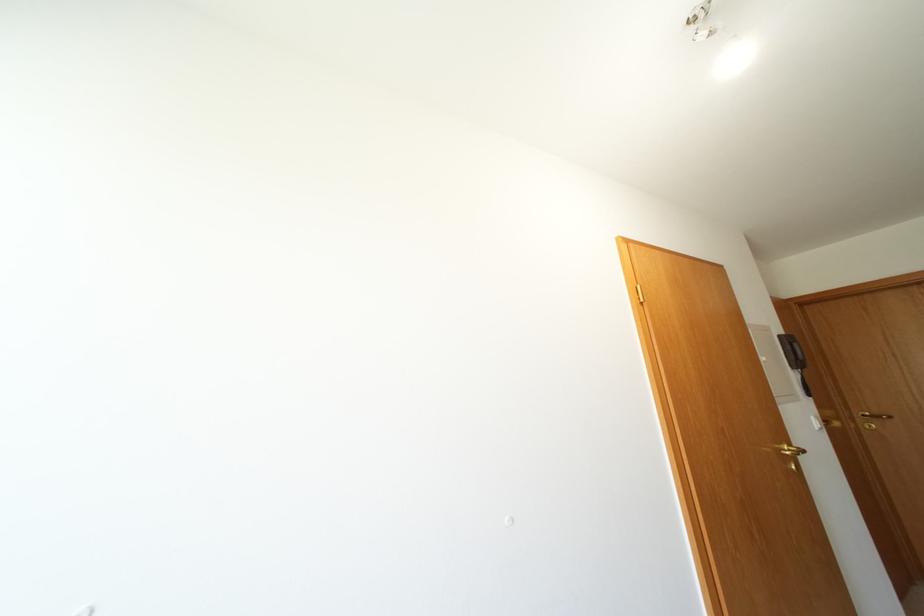
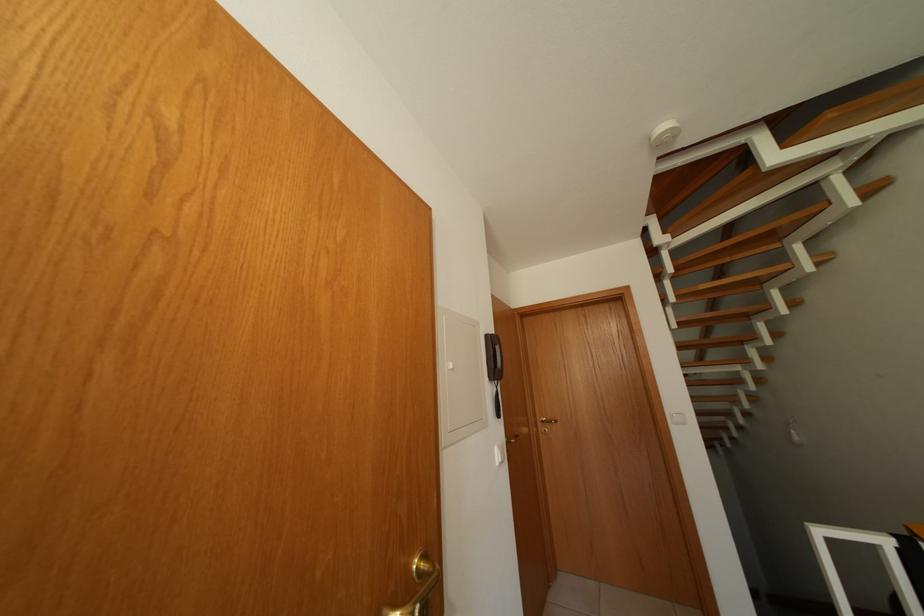
The point at (771, 363) is marked in the first image. Where is the corresponding point in the second image?

(455, 371)